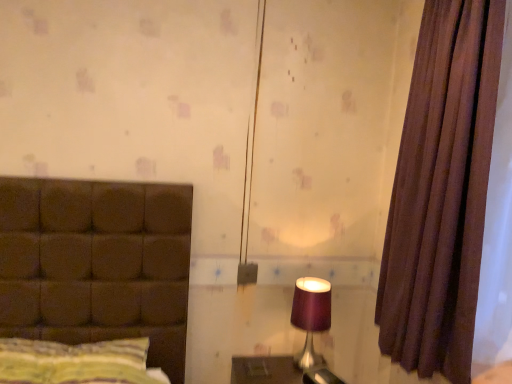
Question: Should I look upward or downward to see striped fabric pillow at left?

Choices:
 (A) up
 (B) down

Answer: (B)

Question: From a real-world perspective, is brown fabric curtain at right over striped fabric pillow at left?

Choices:
 (A) no
 (B) yes

Answer: (B)

Question: Can you confirm if brown fabric curtain at right is wider than striped fabric pillow at left?

Choices:
 (A) yes
 (B) no

Answer: (B)

Question: From the image's perspective, does brown fabric curtain at right appear lower than striped fabric pillow at left?

Choices:
 (A) yes
 (B) no

Answer: (B)

Question: Can you confirm if brown fabric curtain at right is bigger than striped fabric pillow at left?

Choices:
 (A) yes
 (B) no

Answer: (A)

Question: Is brown fabric curtain at right facing away from striped fabric pillow at left?

Choices:
 (A) no
 (B) yes

Answer: (A)

Question: Can you confirm if brown fabric curtain at right is taller than striped fabric pillow at left?

Choices:
 (A) yes
 (B) no

Answer: (A)

Question: Is purple fabric lampshade at right not near brown fabric curtain at right?

Choices:
 (A) yes
 (B) no

Answer: (B)

Question: Does purple fabric lampshade at right have a lesser width compared to brown fabric curtain at right?

Choices:
 (A) no
 (B) yes

Answer: (A)

Question: Does purple fabric lampshade at right have a lesser height compared to brown fabric curtain at right?

Choices:
 (A) no
 (B) yes

Answer: (B)

Question: Is purple fabric lampshade at right behind brown fabric curtain at right?

Choices:
 (A) no
 (B) yes

Answer: (B)

Question: Is purple fabric lampshade at right wider than brown fabric curtain at right?

Choices:
 (A) no
 (B) yes

Answer: (B)

Question: Is purple fabric lampshade at right oriented towards brown fabric curtain at right?

Choices:
 (A) no
 (B) yes

Answer: (A)

Question: Does purple fabric lampshade at right appear on the right side of striped fabric pillow at left?

Choices:
 (A) no
 (B) yes

Answer: (B)